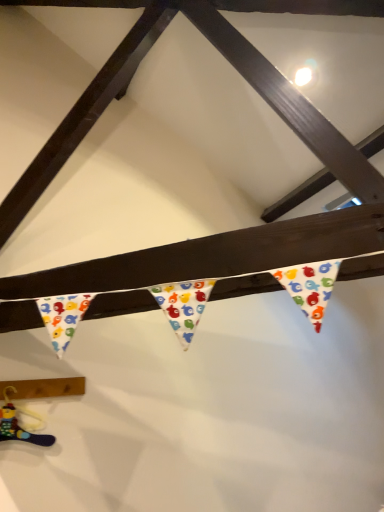
Describe the element at coordinates (18, 423) in the screenshot. I see `plush fabric toy at lower left` at that location.

Measure the distance between plush fabric toy at lower left and camera.

plush fabric toy at lower left and camera are 1.86 meters apart.

Where is `plush fabric toy at lower left`? Image resolution: width=384 pixels, height=512 pixels. plush fabric toy at lower left is located at coordinates (18, 423).

This screenshot has height=512, width=384. Find the location of `plush fabric toy at lower left`. plush fabric toy at lower left is located at coordinates (18, 423).